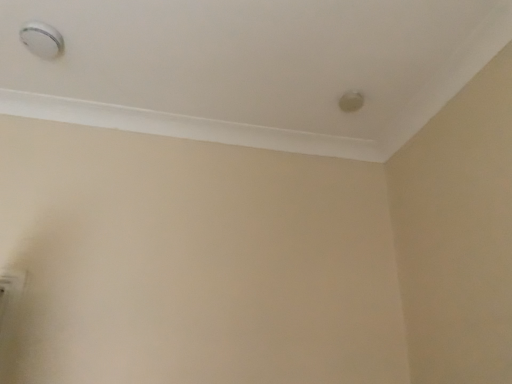
Question: Which is correct: matte white knob at upper right, which is counted as the 2th knob, starting from the front, is inside white plastic smoke detector at upper left, the second knob in the back-to-front sequence, or outside of it?

Choices:
 (A) inside
 (B) outside

Answer: (B)

Question: Relative to white plastic smoke detector at upper left, the second knob positioned from the bottom, is matte white knob at upper right, which is counted as the 2th knob, starting from the front, in front or behind?

Choices:
 (A) front
 (B) behind

Answer: (B)

Question: Is point (348, 99) closer or farther from the camera than point (50, 54)?

Choices:
 (A) closer
 (B) farther

Answer: (B)

Question: In terms of height, does white plastic smoke detector at upper left, acting as the 2th knob starting from the right, look taller or shorter compared to matte white knob at upper right, the first knob from the bottom?

Choices:
 (A) short
 (B) tall

Answer: (B)

Question: Choose the correct answer: Is white plastic smoke detector at upper left, acting as the 2th knob starting from the right, inside matte white knob at upper right, arranged as the second knob when viewed from the left, or outside it?

Choices:
 (A) outside
 (B) inside

Answer: (A)

Question: From the image's perspective, is white plastic smoke detector at upper left, the first knob viewed from the top, positioned above or below matte white knob at upper right, positioned as the second knob in top-to-bottom order?

Choices:
 (A) above
 (B) below

Answer: (A)

Question: Is point (32, 36) positioned closer to the camera than point (350, 105)?

Choices:
 (A) closer
 (B) farther

Answer: (A)